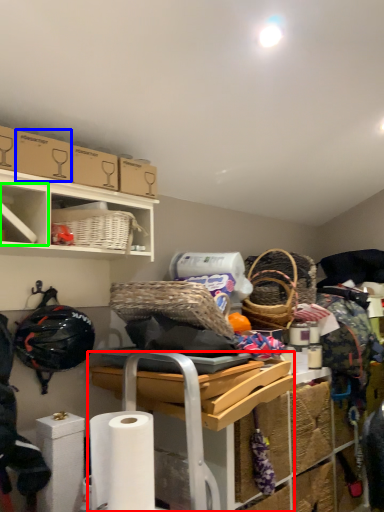
Question: Estimate the real-world distances between objects in this image. Which object is farther from table (highlighted by a red box), cardboard box (highlighted by a blue box) or cabinet (highlighted by a green box)?

Choices:
 (A) cardboard box
 (B) cabinet

Answer: (A)